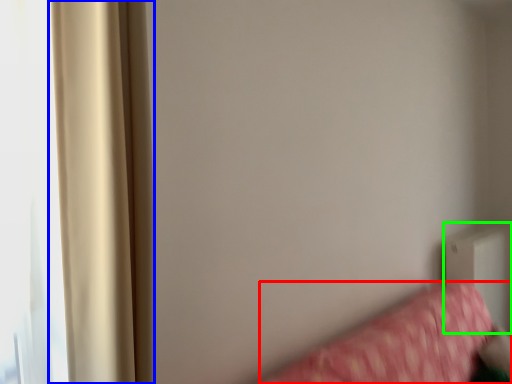
Question: Estimate the real-world distances between objects in this image. Which object is farther from furniture (highlighted by a red box), curtain (highlighted by a blue box) or radiator (highlighted by a green box)?

Choices:
 (A) curtain
 (B) radiator

Answer: (A)